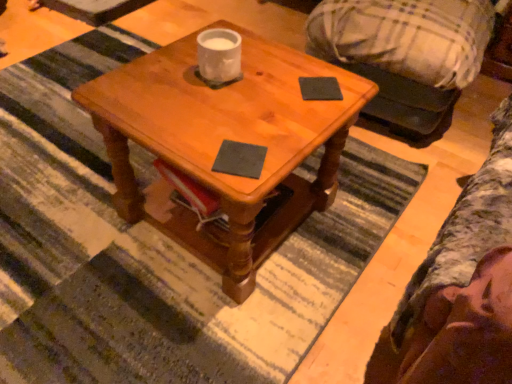
This screenshot has height=384, width=512. I want to click on free point behind black matte notepad at upper right, positioned as the first notepad in top-to-bottom order, so click(x=305, y=64).